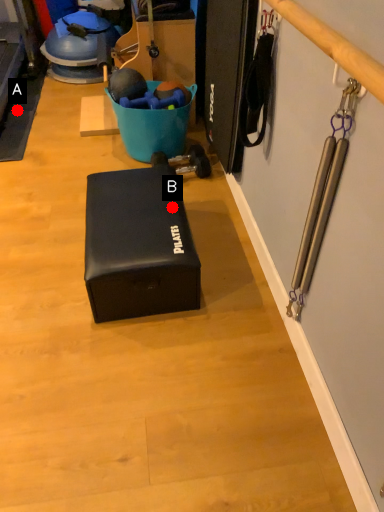
Question: Two points are circled on the image, labeled by A and B beside each circle. Among these points, which one is nearest to the camera?

Choices:
 (A) A is closer
 (B) B is closer

Answer: (B)